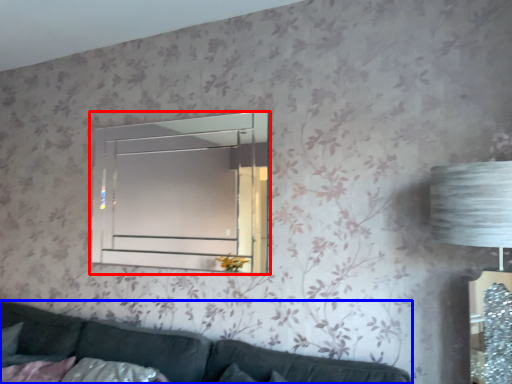
Question: Which object is further to the camera taking this photo, window (highlighted by a red box) or studio couch (highlighted by a blue box)?

Choices:
 (A) window
 (B) studio couch

Answer: (A)